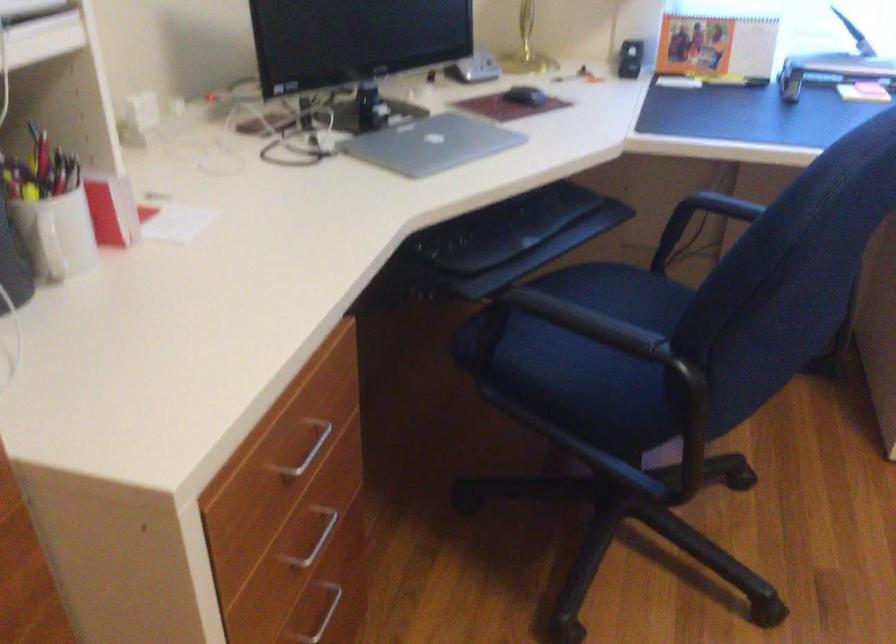
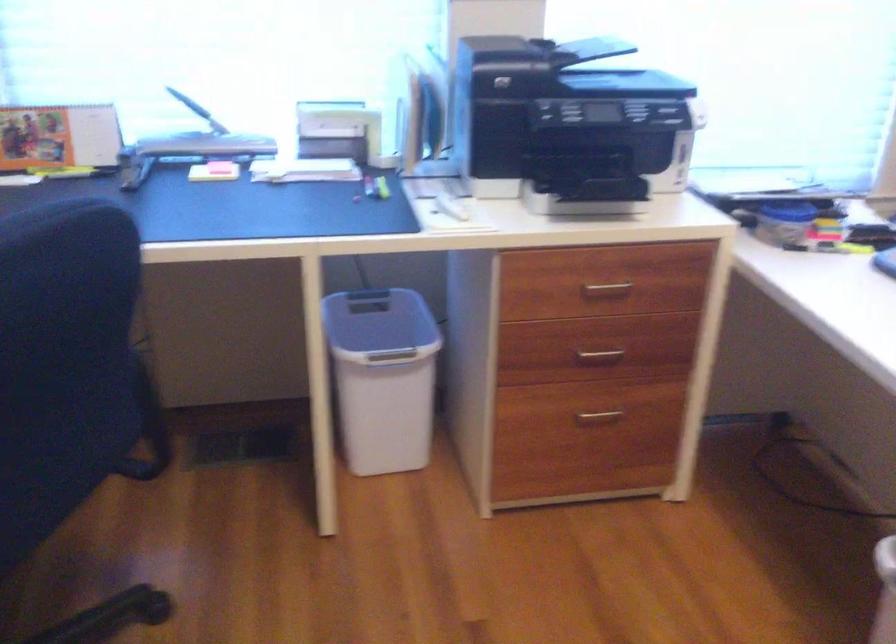
Question: How did the camera likely rotate?

Choices:
 (A) Left
 (B) Right
 (C) Up
 (D) Down

Answer: (B)